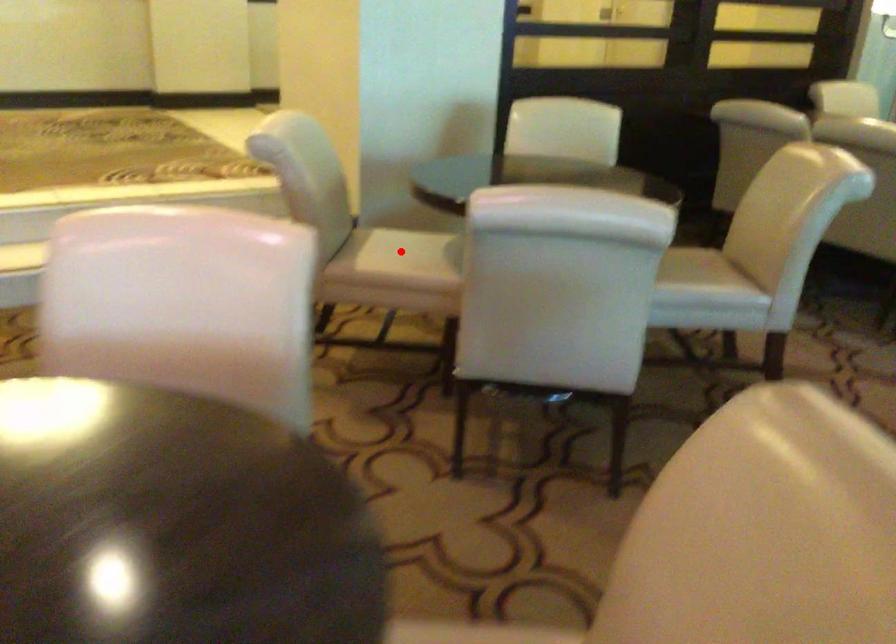
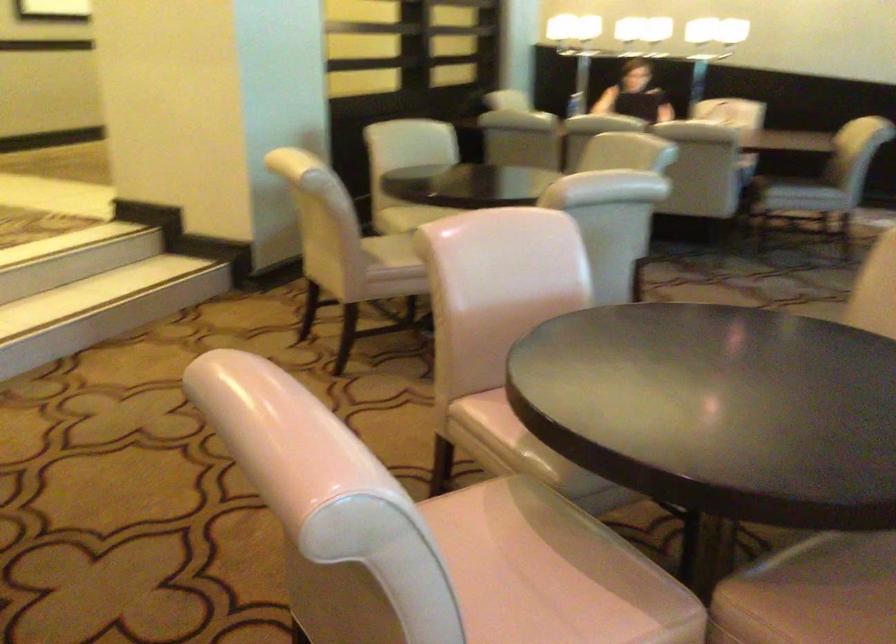
Question: I am providing you with two images of the same scene from different viewpoints. In image1, a red point is highlighted. Considering the same 3D point in image2, which of the following is correct?

Choices:
 (A) It is closer
 (B) It is farther

Answer: (B)